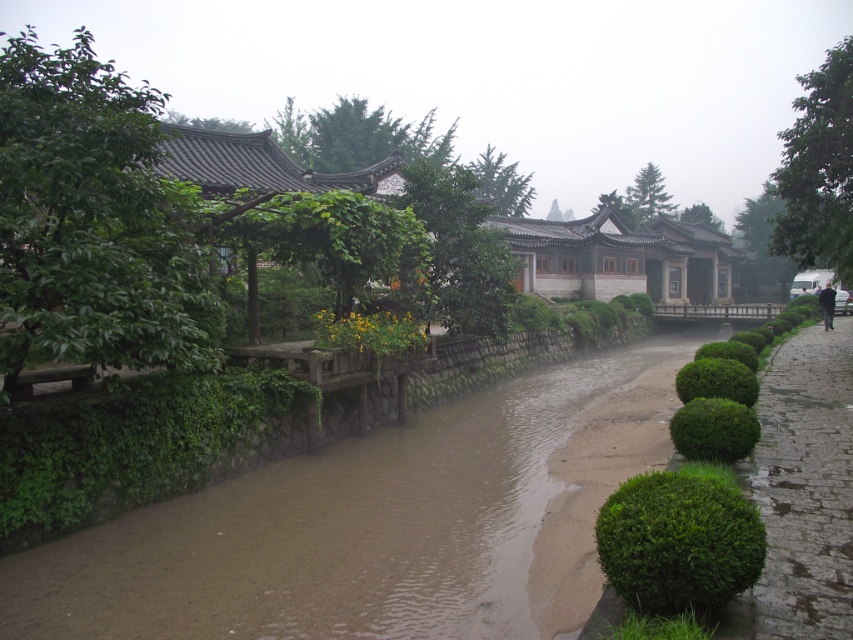
You are a tourist standing at the entrance of the traditional pavilion on the left side of the canal. You want to take a photo of the brown muddy water at center. Where should you position yourself to capture it in the frame?

The brown muddy water at center is located at point 2D coordinates of (378, 522). To capture it in your photo, position yourself so that the camera is aimed towards those coordinates.

You are a tourist walking along the paved stone path at right and want to cross to the traditional pavilion on the left side of the brown muddy water at center. Is the path directly adjacent to the water, or is there a wall or barrier between them?

The brown muddy water at center is to the left of the paved stone path at right, so there is a wall or barrier between them since the path is on the right side of the water and the wall is on the other side.